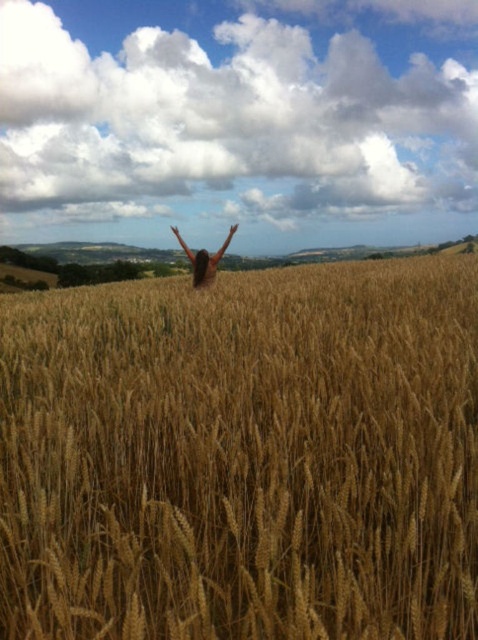
Question: Can you confirm if golden wheat field at center is positioned above brown hair at center?

Choices:
 (A) no
 (B) yes

Answer: (A)

Question: Which point is closer to the camera?

Choices:
 (A) golden wheat field at center
 (B) brown hair at center

Answer: (A)

Question: Does golden wheat field at center appear under brown hair at center?

Choices:
 (A) yes
 (B) no

Answer: (A)

Question: Is golden wheat field at center above brown hair at center?

Choices:
 (A) no
 (B) yes

Answer: (A)